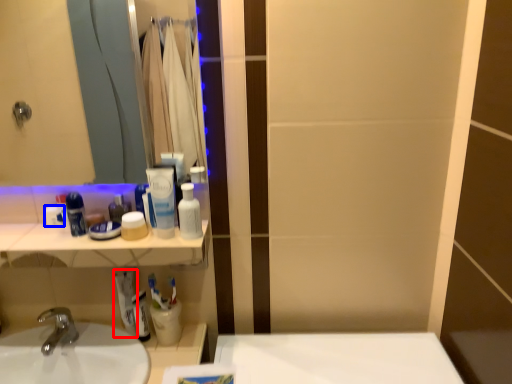
Question: Among these objects, which one is farthest to the camera, toothpaste (highlighted by a red box) or toiletry (highlighted by a blue box)?

Choices:
 (A) toothpaste
 (B) toiletry

Answer: (A)